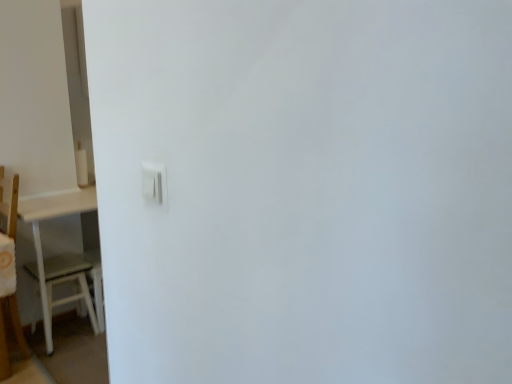
Question: In terms of height, does white wooden table at left look taller or shorter compared to white plastic light switch at center?

Choices:
 (A) tall
 (B) short

Answer: (A)

Question: Based on their positions, is white wooden table at left located to the left or right of white plastic light switch at center?

Choices:
 (A) left
 (B) right

Answer: (A)

Question: Which is farther from the white wooden table at left?

Choices:
 (A) white plastic light switch at center
 (B) white matte table at left

Answer: (A)

Question: Which of these objects is positioned closest to the white plastic light switch at center?

Choices:
 (A) white wooden table at left
 (B) white matte table at left

Answer: (A)